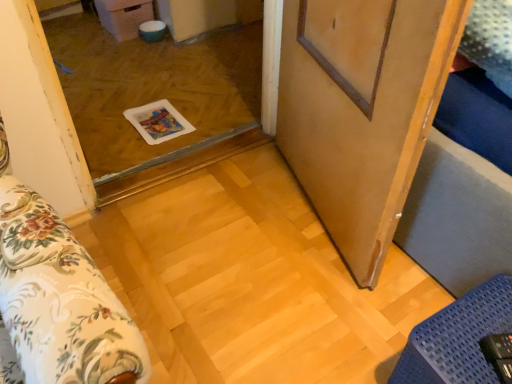
Question: Is transparent plastic tray at center oriented away from blue textured mat at lower right?

Choices:
 (A) yes
 (B) no

Answer: (B)

Question: From a real-world perspective, is transparent plastic tray at center under blue textured mat at lower right?

Choices:
 (A) no
 (B) yes

Answer: (B)

Question: Is transparent plastic tray at center with blue textured mat at lower right?

Choices:
 (A) yes
 (B) no

Answer: (B)

Question: From the image's perspective, does transparent plastic tray at center appear lower than blue textured mat at lower right?

Choices:
 (A) yes
 (B) no

Answer: (B)

Question: Does transparent plastic tray at center come in front of blue textured mat at lower right?

Choices:
 (A) no
 (B) yes

Answer: (A)

Question: Is point (497, 344) positioned closer to the camera than point (287, 109)?

Choices:
 (A) farther
 (B) closer

Answer: (B)

Question: From the image's perspective, is blue textured mat at lower right above or below wooden barn door at center?

Choices:
 (A) below
 (B) above

Answer: (A)

Question: Is blue textured mat at lower right in front of or behind wooden barn door at center in the image?

Choices:
 (A) front
 (B) behind

Answer: (B)

Question: Looking at their shapes, would you say blue textured mat at lower right is wider or thinner than wooden barn door at center?

Choices:
 (A) wide
 (B) thin

Answer: (A)

Question: From a real-world perspective, is transparent plastic tray at center above or below wooden barn door at center?

Choices:
 (A) below
 (B) above

Answer: (A)

Question: Looking at their shapes, would you say transparent plastic tray at center is wider or thinner than wooden barn door at center?

Choices:
 (A) thin
 (B) wide

Answer: (B)

Question: Considering the positions of transparent plastic tray at center and wooden barn door at center in the image, is transparent plastic tray at center taller or shorter than wooden barn door at center?

Choices:
 (A) short
 (B) tall

Answer: (A)

Question: From the image's perspective, is transparent plastic tray at center positioned above or below wooden barn door at center?

Choices:
 (A) below
 (B) above

Answer: (B)

Question: From their relative heights in the image, would you say wooden barn door at center is taller or shorter than blue textured mat at lower right?

Choices:
 (A) short
 (B) tall

Answer: (B)

Question: Is wooden barn door at center in front of or behind blue textured mat at lower right in the image?

Choices:
 (A) behind
 (B) front

Answer: (B)